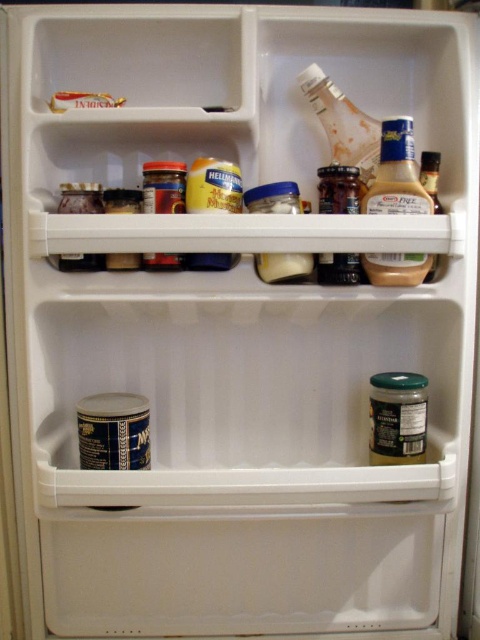
Between point (217, 268) and point (269, 193), which one is positioned in front?

Point (269, 193)

Is yellow matte mustard at center positioned at the back of matte plastic jar at center?

No, it is not.

Is point (219, 170) positioned in front of point (284, 266)?

No, it is not.

Locate an element on the screen. yellow matte mustard at center is located at coordinates (214, 186).

Is matte plastic jar at upper center wider than translucent plastic bottle at upper right?

Yes, matte plastic jar at upper center is wider than translucent plastic bottle at upper right.

Does matte plastic jar at upper center appear on the right side of translucent plastic bottle at upper right?

Incorrect, matte plastic jar at upper center is not on the right side of translucent plastic bottle at upper right.

Find the location of a particular element. This screenshot has width=480, height=640. matte plastic jar at upper center is located at coordinates (81, 198).

I want to click on matte plastic jar at upper center, so click(81, 198).

Is yellow matte mustard at center taller than matte plastic jar at upper center?

Yes, yellow matte mustard at center is taller than matte plastic jar at upper center.

Based on the photo, can you confirm if yellow matte mustard at center is positioned to the right of matte plastic jar at upper center?

Correct, you'll find yellow matte mustard at center to the right of matte plastic jar at upper center.

Where is `yellow matte mustard at center`? The image size is (480, 640). yellow matte mustard at center is located at coordinates (214, 186).

Identify the location of yellow matte mustard at center. (214, 186).